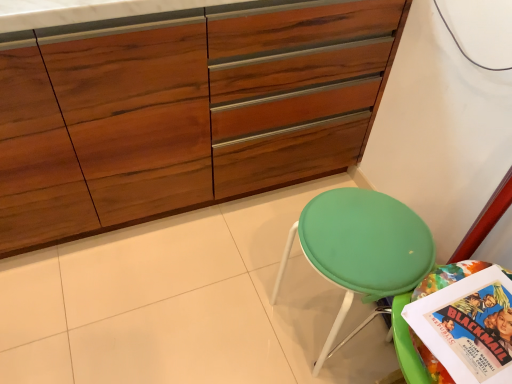
Question: Can you confirm if green fabric stool at lower right is taller than wooden cabinet at center?

Choices:
 (A) no
 (B) yes

Answer: (A)

Question: Considering the relative sizes of green fabric stool at lower right and wooden cabinet at center in the image provided, is green fabric stool at lower right thinner than wooden cabinet at center?

Choices:
 (A) yes
 (B) no

Answer: (A)

Question: Are green fabric stool at lower right and wooden cabinet at center far apart?

Choices:
 (A) yes
 (B) no

Answer: (B)

Question: Considering the relative sizes of green fabric stool at lower right and wooden cabinet at center in the image provided, is green fabric stool at lower right bigger than wooden cabinet at center?

Choices:
 (A) yes
 (B) no

Answer: (B)

Question: Can you confirm if green fabric stool at lower right is positioned to the right of wooden cabinet at center?

Choices:
 (A) yes
 (B) no

Answer: (A)

Question: In the image, is wooden cabinet at center positioned in front of or behind multicolored paper comic book at lower right?

Choices:
 (A) front
 (B) behind

Answer: (B)

Question: From a real-world perspective, is wooden cabinet at center physically located above or below multicolored paper comic book at lower right?

Choices:
 (A) above
 (B) below

Answer: (B)

Question: In terms of size, does wooden cabinet at center appear bigger or smaller than multicolored paper comic book at lower right?

Choices:
 (A) big
 (B) small

Answer: (A)

Question: Is wooden cabinet at center wider or thinner than multicolored paper comic book at lower right?

Choices:
 (A) wide
 (B) thin

Answer: (A)

Question: From the image's perspective, relative to multicolored paper comic book at lower right, is green fabric stool at lower right above or below?

Choices:
 (A) below
 (B) above

Answer: (B)

Question: Visually, is green fabric stool at lower right positioned to the left or to the right of multicolored paper comic book at lower right?

Choices:
 (A) right
 (B) left

Answer: (B)

Question: Is green fabric stool at lower right spatially inside multicolored paper comic book at lower right, or outside of it?

Choices:
 (A) outside
 (B) inside

Answer: (A)

Question: In terms of size, does green fabric stool at lower right appear bigger or smaller than multicolored paper comic book at lower right?

Choices:
 (A) big
 (B) small

Answer: (A)

Question: Considering the positions of point [233, 84] and point [365, 248], is point [233, 84] closer or farther from the camera than point [365, 248]?

Choices:
 (A) closer
 (B) farther

Answer: (B)

Question: From a real-world perspective, relative to green fabric stool at lower right, is wooden cabinet at center vertically above or below?

Choices:
 (A) above
 (B) below

Answer: (A)